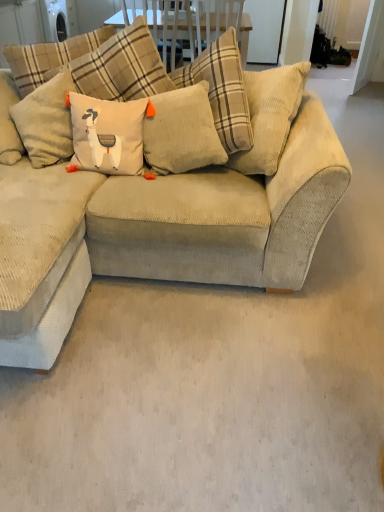
This screenshot has height=512, width=384. Describe the element at coordinates (163, 218) in the screenshot. I see `beige corduroy couch at center` at that location.

Where is `beige corduroy couch at center`? beige corduroy couch at center is located at coordinates (163, 218).

You are a GUI agent. You are given a task and a screenshot of the screen. Output one action in this format:
    pyautogui.click(x=<x>, y=<y>)
    Task: Click on the corduroy pillow at center
    Image resolution: width=384 pixels, height=512 pixels.
    Given the screenshot: What is the action you would take?
    pyautogui.click(x=182, y=132)

Describe the element at coordinates (182, 132) in the screenshot. I see `corduroy pillow at center` at that location.

At what (x,y) coordinates should I click in order to perform the action: click on beige corduroy couch at center. Please return your answer as a coordinate pair (x, y). The height and width of the screenshot is (512, 384). Looking at the image, I should click on (163, 218).

Which object is positioned more to the right, beige corduroy couch at center or corduroy pillow at center?

Positioned to the right is corduroy pillow at center.

In the image, is beige corduroy couch at center positioned in front of or behind corduroy pillow at center?

Visually, beige corduroy couch at center is located in front of corduroy pillow at center.

Considering the points (135, 62) and (217, 140), which point is behind, point (135, 62) or point (217, 140)?

The point (135, 62) is farther.

From the image's perspective, is beige corduroy couch at center beneath corduroy pillow at center?

Correct, beige corduroy couch at center appears lower than corduroy pillow at center in the image.

Looking at this image, from a real-world perspective, is beige corduroy couch at center over corduroy pillow at center?

No.

Which object is wider, beige corduroy couch at center or corduroy pillow at center?

beige corduroy couch at center.

Who is taller, beige corduroy couch at center or corduroy pillow at center?

beige corduroy couch at center.

Considering the relative sizes of beige corduroy couch at center and corduroy pillow at center in the image provided, is beige corduroy couch at center smaller than corduroy pillow at center?

No, beige corduroy couch at center is not smaller than corduroy pillow at center.

Is beige corduroy couch at center outside of corduroy pillow at center?

beige corduroy couch at center is positioned outside corduroy pillow at center.

Are beige corduroy couch at center and corduroy pillow at center making contact?

No.

Could you tell me if beige corduroy couch at center is turned towards corduroy pillow at center?

Yes, beige corduroy couch at center is facing corduroy pillow at center.

What's the angular difference between beige corduroy couch at center and corduroy pillow at center's facing directions?

The angular difference between beige corduroy couch at center and corduroy pillow at center is 9.53 degrees.

Find the location of a particular element. Image resolution: width=384 pixels, height=512 pixels. studio couch on the left side of corduroy pillow at center is located at coordinates (163, 218).

Considering the relative positions of corduroy pillow at center and beige corduroy couch at center in the image provided, is corduroy pillow at center to the right of beige corduroy couch at center from the viewer's perspective?

Yes.

Relative to beige corduroy couch at center, is corduroy pillow at center in front or behind?

Clearly, corduroy pillow at center is behind beige corduroy couch at center.

Is point (164, 151) behind point (11, 187)?

Yes, point (164, 151) is behind point (11, 187).

From the image's perspective, which one is positioned higher, corduroy pillow at center or beige corduroy couch at center?

corduroy pillow at center, from the image's perspective.

From a real-world perspective, does corduroy pillow at center sit lower than beige corduroy couch at center?

Actually, corduroy pillow at center is physically above beige corduroy couch at center in the real world.

Between corduroy pillow at center and beige corduroy couch at center, which one has larger width?

beige corduroy couch at center.

Can you confirm if corduroy pillow at center is taller than beige corduroy couch at center?

In fact, corduroy pillow at center may be shorter than beige corduroy couch at center.

Which of these two, corduroy pillow at center or beige corduroy couch at center, is smaller?

corduroy pillow at center is smaller.

Is corduroy pillow at center completely or partially outside of beige corduroy couch at center?

No, most part of corduroy pillow at center lies within beige corduroy couch at center.

Are corduroy pillow at center and beige corduroy couch at center located far from each other?

No, corduroy pillow at center is not far away from beige corduroy couch at center.

Could you tell me if corduroy pillow at center is turned towards beige corduroy couch at center?

Yes, corduroy pillow at center is oriented towards beige corduroy couch at center.

What's the angular difference between corduroy pillow at center and beige corduroy couch at center's facing directions?

The angular difference between corduroy pillow at center and beige corduroy couch at center is 9.53 degrees.

At what (x,y) coordinates should I click in order to perform the action: click on pillow above the beige corduroy couch at center (from the image's perspective). Please return your answer as a coordinate pair (x, y). The height and width of the screenshot is (512, 384). Looking at the image, I should click on (182, 132).

Locate an element on the screen. studio couch below the corduroy pillow at center (from a real-world perspective) is located at coordinates (163, 218).

Find the location of `pillow lying above the beige corduroy couch at center (from the image's perspective)`. pillow lying above the beige corduroy couch at center (from the image's perspective) is located at coordinates (182, 132).